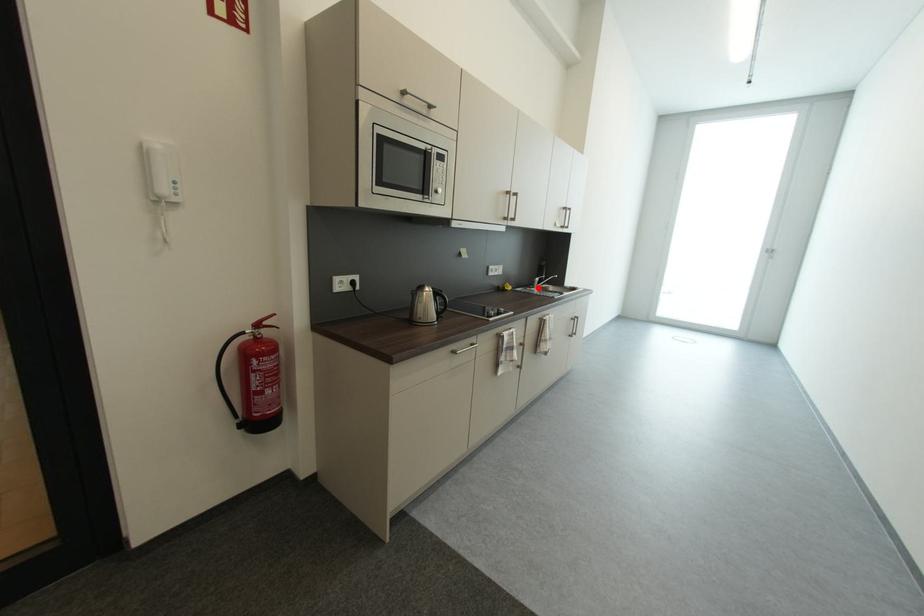
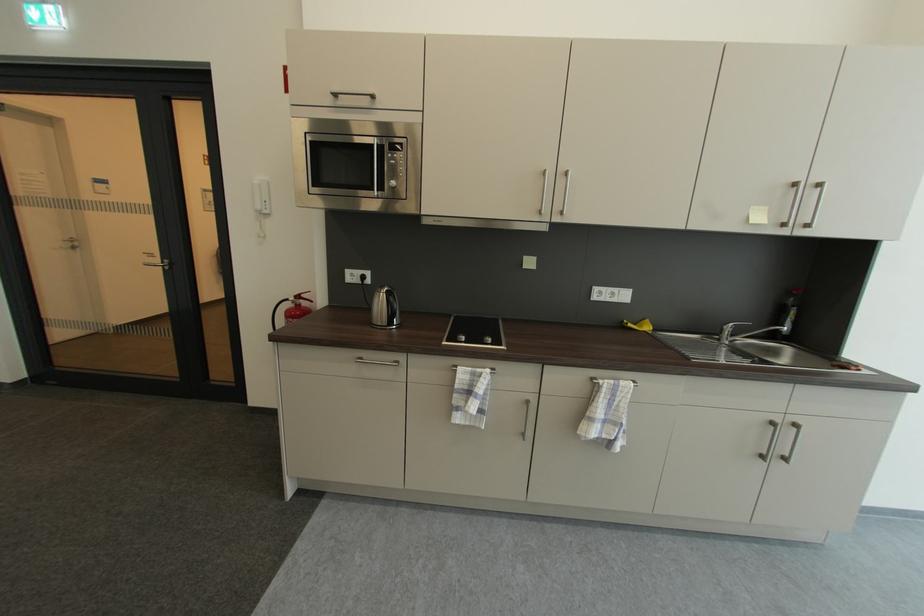
Find the pixel in the second image that matches the highlighted location in the first image.

(723, 339)